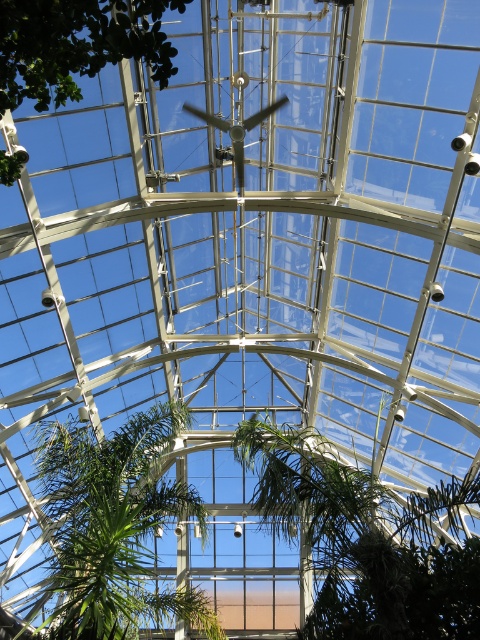
You are planning to place a new bench in the conservatory. The bench is 1.5 meters wide. You see the green leafy tree at center and the green leafy plant at center. Which one has enough space between them to fit the bench?

The green leafy tree at center has a larger width than the green leafy plant at center. Therefore, the space between them would be sufficient to fit the 1.5 meter wide bench.

You are standing inside the glass structure and want to find the green leafy tree at center. Which direction should you look relative to the green leafy tree at upper center?

The green leafy tree at center is located below the green leafy tree at upper center, so you should look downward from the green leafy tree at upper center to find it.

You are standing in the conservatory and want to locate the green leafy tree at center. According to the coordinates provided, where should you look to find it?

The green leafy tree at center is located at coordinates point (365, 541).